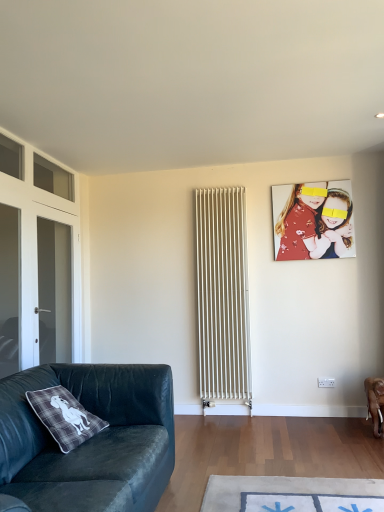
Question: Would you say velvet dark green couch at lower left is to the left or to the right of matte red shirt at upper right in the picture?

Choices:
 (A) left
 (B) right

Answer: (A)

Question: From the image's perspective, is velvet dark green couch at lower left above or below matte red shirt at upper right?

Choices:
 (A) above
 (B) below

Answer: (B)

Question: Estimate the real-world distances between objects in this image. Which object is farther from the velvet dark green couch at lower left?

Choices:
 (A) matte red shirt at upper right
 (B) transparent glass door at left, which is counted as the second glass door, starting from the back
 (C) transparent glass door at left, the 1th glass door viewed from the back
 (D) white metal radiator at center

Answer: (A)

Question: Which is nearer to the transparent glass door at left, the second glass door positioned from the front?

Choices:
 (A) transparent glass door at left, which is counted as the first glass door, starting from the front
 (B) matte red shirt at upper right
 (C) velvet dark green couch at lower left
 (D) white metal radiator at center

Answer: (A)